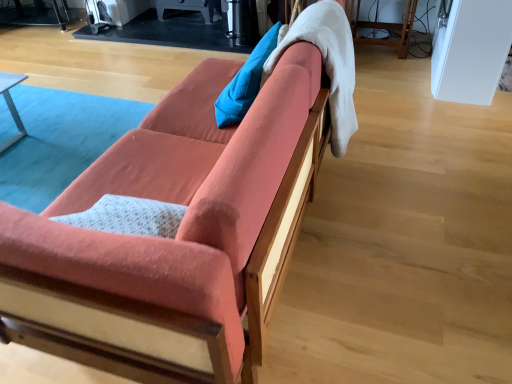
Question: Is blue fabric pillow at upper center wider or thinner than coral fabric couch at center?

Choices:
 (A) wide
 (B) thin

Answer: (B)

Question: From the image's perspective, is blue fabric pillow at upper center above or below coral fabric couch at center?

Choices:
 (A) above
 (B) below

Answer: (A)

Question: Which is nearer to the white soft blanket at upper right?

Choices:
 (A) blue fabric pillow at upper center
 (B) coral fabric couch at center

Answer: (A)

Question: Considering the real-world distances, which object is closest to the blue fabric pillow at upper center?

Choices:
 (A) white soft blanket at upper right
 (B) coral fabric couch at center

Answer: (A)